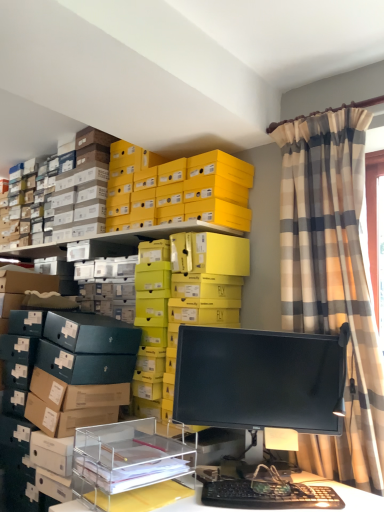
Question: Considering the positions of plaid fabric curtain at upper right and yellow cardboard boxes at upper center, the 1th shelf positioned from the back, in the image, is plaid fabric curtain at upper right taller or shorter than yellow cardboard boxes at upper center, the 1th shelf positioned from the back,?

Choices:
 (A) tall
 (B) short

Answer: (A)

Question: From the image's perspective, relative to yellow cardboard boxes at upper center, the 1th shelf positioned from the back, is plaid fabric curtain at upper right above or below?

Choices:
 (A) below
 (B) above

Answer: (B)

Question: Which of these objects is positioned farthest from the clear acrylic organizer at lower center, which is counted as the first shelf, starting from the front?

Choices:
 (A) yellow matte shoebox at upper center
 (B) black glossy monitor at center
 (C) black plastic keyboard at lower center
 (D) yellow cardboard boxes at upper center, the second shelf viewed from the front
 (E) plaid fabric curtain at upper right

Answer: (A)

Question: Which object is positioned farthest from the yellow matte shoebox at upper center?

Choices:
 (A) black glossy monitor at center
 (B) yellow cardboard boxes at upper center, the second shelf viewed from the front
 (C) plaid fabric curtain at upper right
 (D) black plastic keyboard at lower center
 (E) clear acrylic organizer at lower center, the 2th shelf when ordered from back to front

Answer: (D)